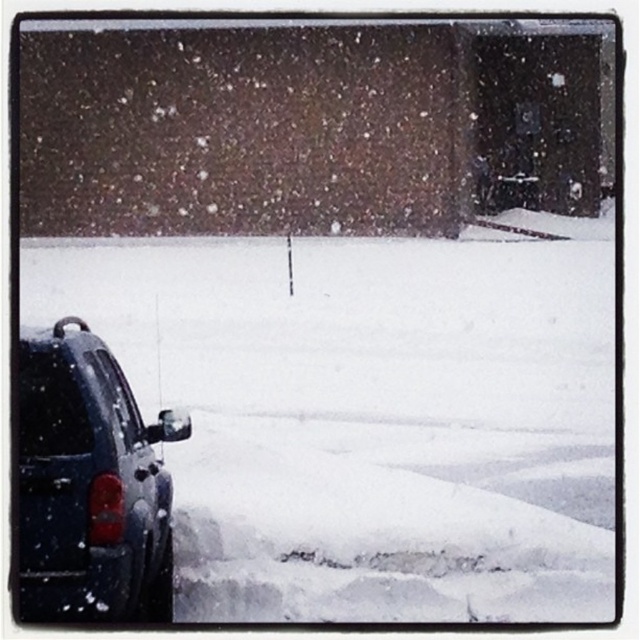
Question: Can you confirm if white fluffy snow at lower left is smaller than glossy dark blue car at lower left?

Choices:
 (A) yes
 (B) no

Answer: (B)

Question: Is white fluffy snow at lower left behind glossy dark blue car at lower left?

Choices:
 (A) no
 (B) yes

Answer: (B)

Question: Can you confirm if white fluffy snow at lower left is bigger than glossy dark blue car at lower left?

Choices:
 (A) yes
 (B) no

Answer: (A)

Question: Which point is farther to the camera?

Choices:
 (A) white fluffy snow at lower left
 (B) glossy dark blue car at lower left

Answer: (A)